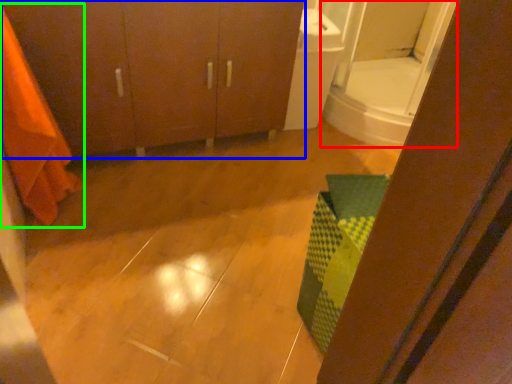
Question: Estimate the real-world distances between objects in this image. Which object is farther from mirror (highlighted by a red box), bathroom cabinet (highlighted by a blue box) or shower curtain (highlighted by a green box)?

Choices:
 (A) bathroom cabinet
 (B) shower curtain

Answer: (B)